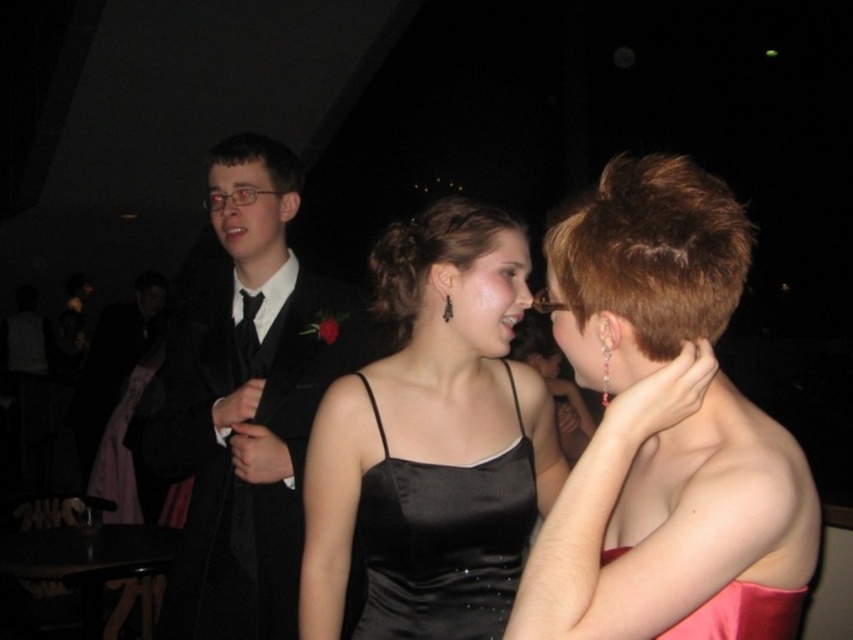
Question: Can you confirm if pink satin dress at center is positioned to the right of black satin suit at left?

Choices:
 (A) yes
 (B) no

Answer: (A)

Question: Which of the following is the closest to the observer?

Choices:
 (A) black satin tie at center
 (B) pink satin dress at center

Answer: (B)

Question: Which object is the farthest from the black satin dress at center?

Choices:
 (A) black satin suit at left
 (B) satin black dress at center
 (C) black satin tie at center
 (D) satin pink dress at lower right

Answer: (C)

Question: Can you confirm if satin black dress at center is smaller than black satin suit at left?

Choices:
 (A) no
 (B) yes

Answer: (B)

Question: Which point is farther to the camera?

Choices:
 (A) black satin tie at center
 (B) satin black dress at center
 (C) black satin dress at center

Answer: (A)

Question: Can you confirm if pink satin dress at center is positioned above black satin suit at left?

Choices:
 (A) no
 (B) yes

Answer: (B)